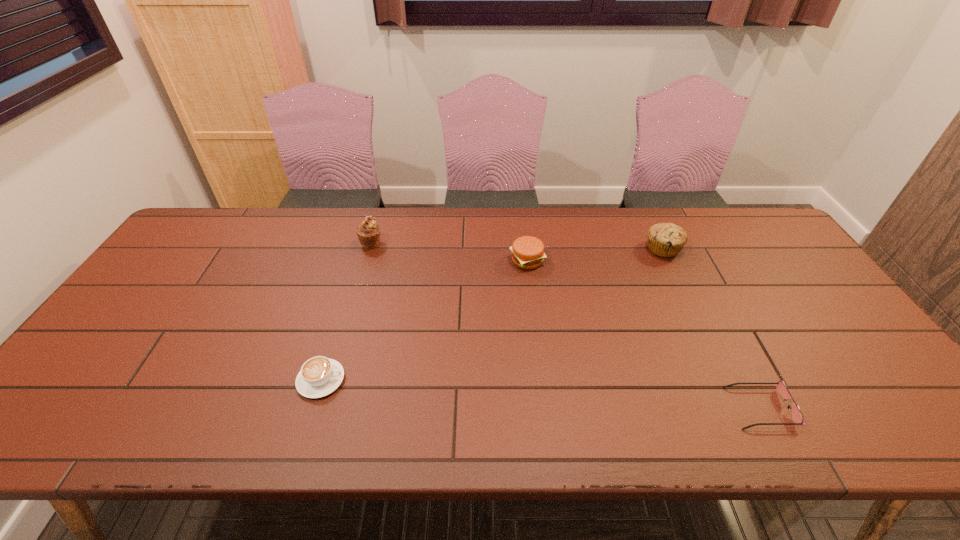
This screenshot has height=540, width=960. I want to click on the left muffin, so click(x=368, y=232).

At what (x,y) coordinates should I click in order to perform the action: click on the right muffin. Please return your answer as a coordinate pair (x, y). This screenshot has width=960, height=540. Looking at the image, I should click on (664, 239).

Image resolution: width=960 pixels, height=540 pixels. I want to click on hamburger, so click(x=527, y=252).

The image size is (960, 540). In order to click on the third object from left to right in this screenshot , I will do `click(527, 252)`.

This screenshot has height=540, width=960. Find the location of `cappuccino`. cappuccino is located at coordinates (319, 376).

This screenshot has width=960, height=540. Find the location of `the shortest object`. the shortest object is located at coordinates (797, 417).

At what (x,y) coordinates should I click in order to perform the action: click on vacant space located on the front of the left muffin. Please return your answer as a coordinate pair (x, y). This screenshot has width=960, height=540. Looking at the image, I should click on (355, 300).

Where is `vacant space located 0.330m on the right of the right muffin`? The image size is (960, 540). vacant space located 0.330m on the right of the right muffin is located at coordinates (786, 249).

This screenshot has width=960, height=540. In order to click on vacant space located 0.160m on the right of the hamburger in this screenshot , I will do `click(597, 261)`.

Identify the location of vacant space located 0.310m on the side of the second shortest object with the handle. The height and width of the screenshot is (540, 960). (476, 380).